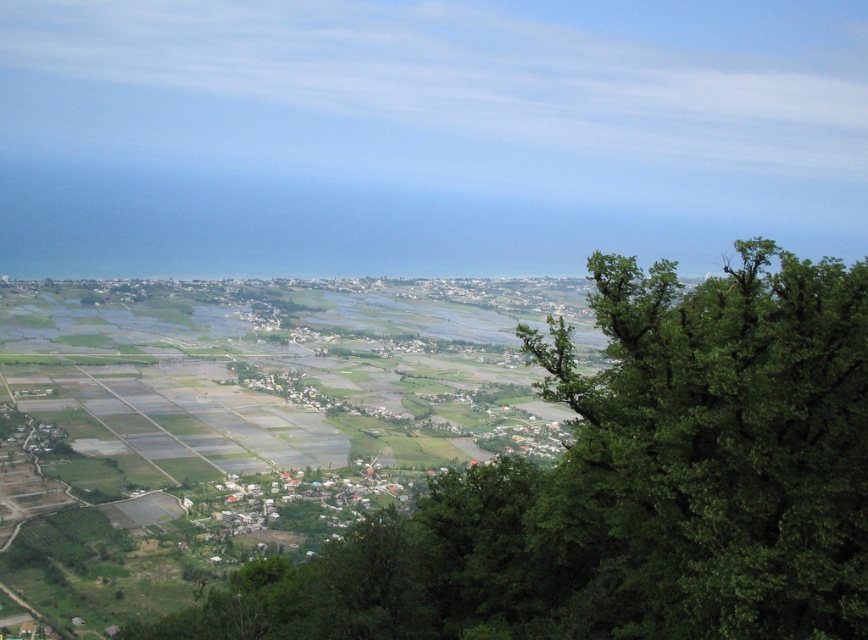
Between point (717, 404) and point (632, 493), which one is positioned in front?

Point (717, 404)

From the picture: Between green leafy tree at center and green leafy tree at right, which one appears on the right side from the viewer's perspective?

green leafy tree at right

At what (x,y) coordinates should I click in order to perform the action: click on green leafy tree at center. Please return your answer as a coordinate pair (x, y). The width and height of the screenshot is (868, 640). Looking at the image, I should click on (628, 486).

Identify the location of green leafy tree at center. (628, 486).